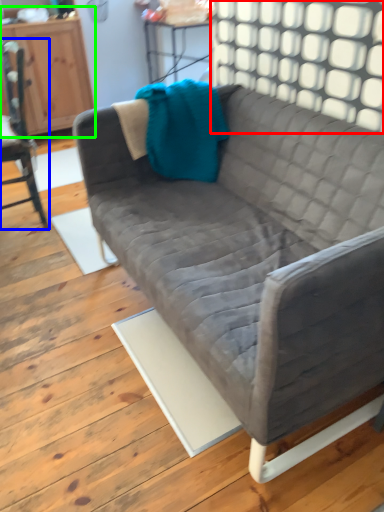
Question: Which object is the farthest from window (highlighted by a red box)? Choose among these: chair (highlighted by a blue box) or dresser (highlighted by a green box).

Choices:
 (A) chair
 (B) dresser

Answer: (B)